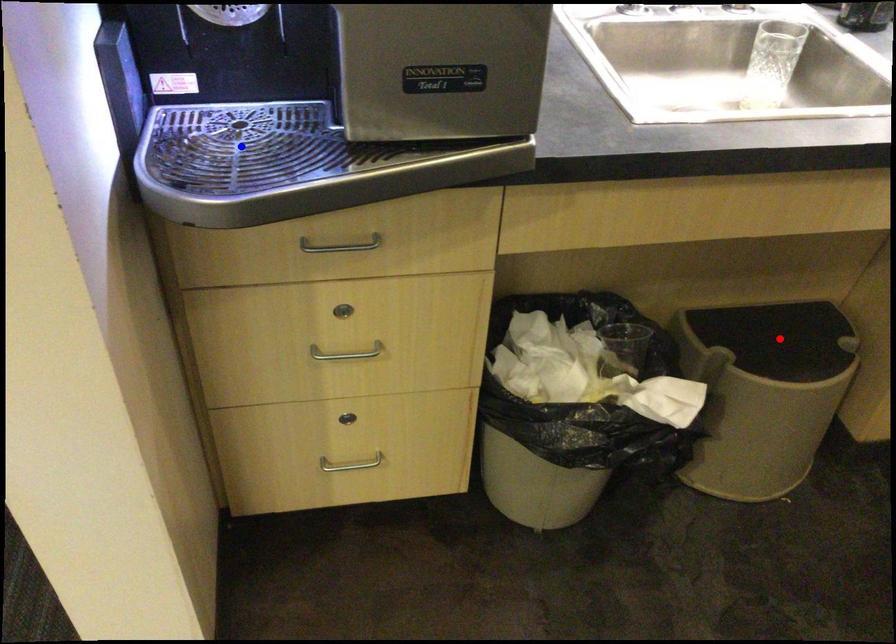
Question: In the image, two points are highlighted. Which point is nearer to the camera? Reply with the corresponding letter.

Choices:
 (A) blue point
 (B) red point

Answer: (A)